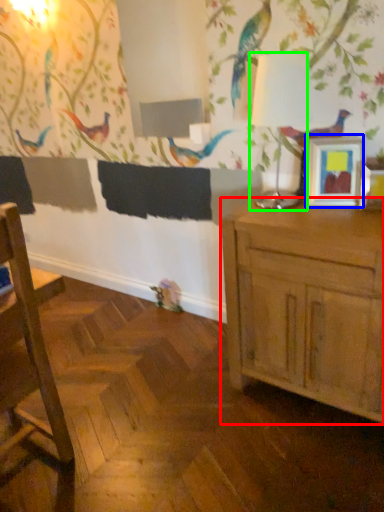
Question: Which object is positioned closest to cabinetry (highlighted by a red box)? Select from picture frame (highlighted by a blue box) and table lamp (highlighted by a green box).

Choices:
 (A) picture frame
 (B) table lamp

Answer: (A)